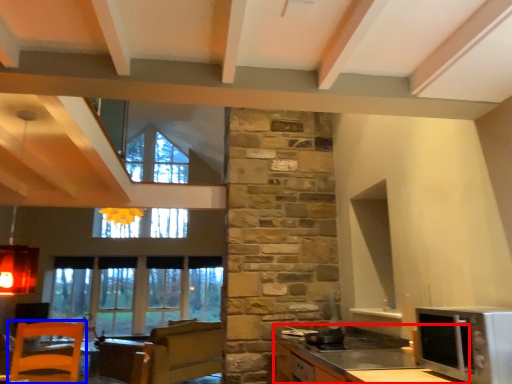
Question: Which object is further to the camera taking this photo, cabinetry (highlighted by a red box) or chair (highlighted by a blue box)?

Choices:
 (A) cabinetry
 (B) chair

Answer: (B)